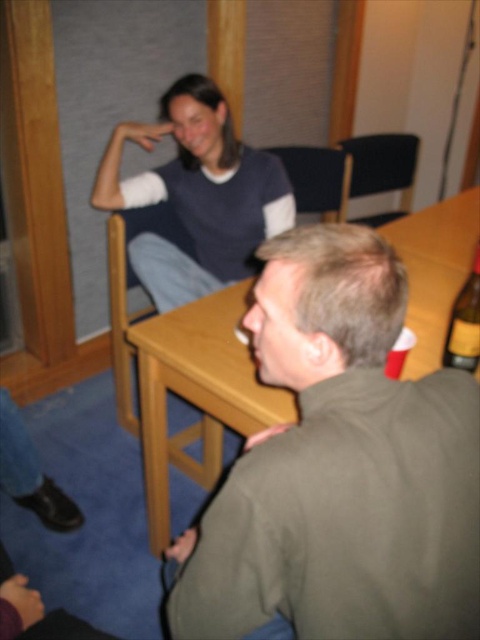
You are standing at the center of the room and want to hand a document to the person wearing the green matte jacket at lower right. Based on their position coordinates, in which general direction should you move to approach them?

The green matte jacket at lower right is located at coordinates point (340, 467), which corresponds to the lower right direction from your current position at the center. Move towards the lower right direction to reach them.

You are standing in front of the wooden chair at center and want to take a photo of it with your phone. If your phone can focus on objects up to 6 feet away, will it be able to capture the chair clearly?

The wooden chair at center is 5.94 feet away from the camera, which is within the phone camera focus range of up to 6 feet. Therefore, the phone can focus on the wooden chair at center and capture it clearly.

You are trying to place the yellow label glass bottle at table right on the wooden chair at center. Will it fit on top of the chair?

The wooden chair at center is taller than the yellow label glass bottle at table right, so yes, the bottle can be placed on top of the wooden chair at center since it is shorter than the chair.